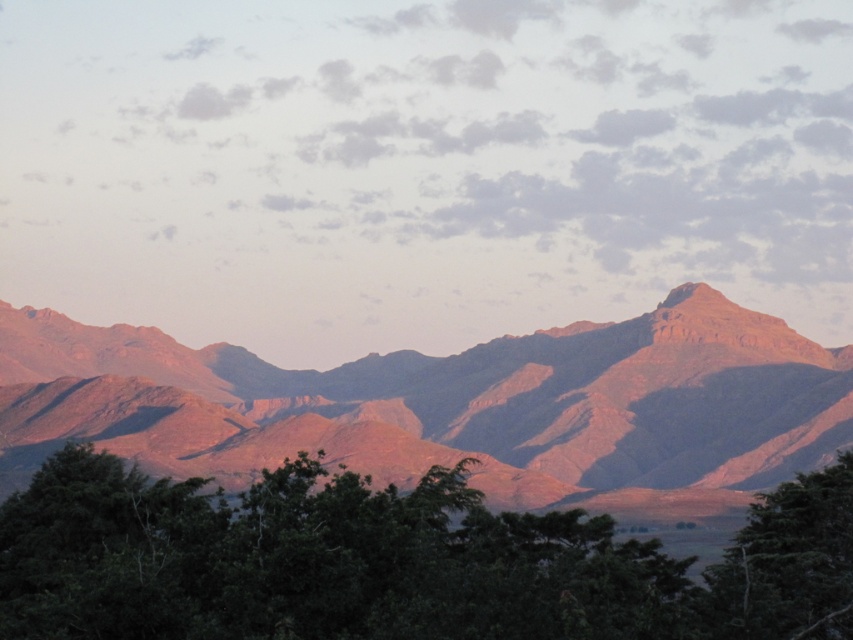
Is green leafy tree at lower center to the left of green leafy tree at lower right from the viewer's perspective?

Yes, green leafy tree at lower center is to the left of green leafy tree at lower right.

The height and width of the screenshot is (640, 853). Find the location of `green leafy tree at lower center`. green leafy tree at lower center is located at coordinates (396, 563).

Who is more distant from viewer, [102,518] or [840,588]?

Point [102,518]

Find the location of a particular element. green leafy tree at lower center is located at coordinates (396, 563).

From the picture: Which is below, rustic rock mountain range at center or green leafy tree at lower center?

Positioned lower is rustic rock mountain range at center.

Is rustic rock mountain range at center below green leafy tree at lower center?

Yes, rustic rock mountain range at center is below green leafy tree at lower center.

Is point (607, 358) closer to camera compared to point (302, 561)?

No, (607, 358) is behind (302, 561).

The width and height of the screenshot is (853, 640). I want to click on rustic rock mountain range at center, so click(454, 406).

Between rustic rock mountain range at center and green leafy tree at lower right, which one has less height?

With less height is green leafy tree at lower right.

Is rustic rock mountain range at center shorter than green leafy tree at lower right?

In fact, rustic rock mountain range at center may be taller than green leafy tree at lower right.

The image size is (853, 640). What are the coordinates of `rustic rock mountain range at center` in the screenshot? It's located at (454, 406).